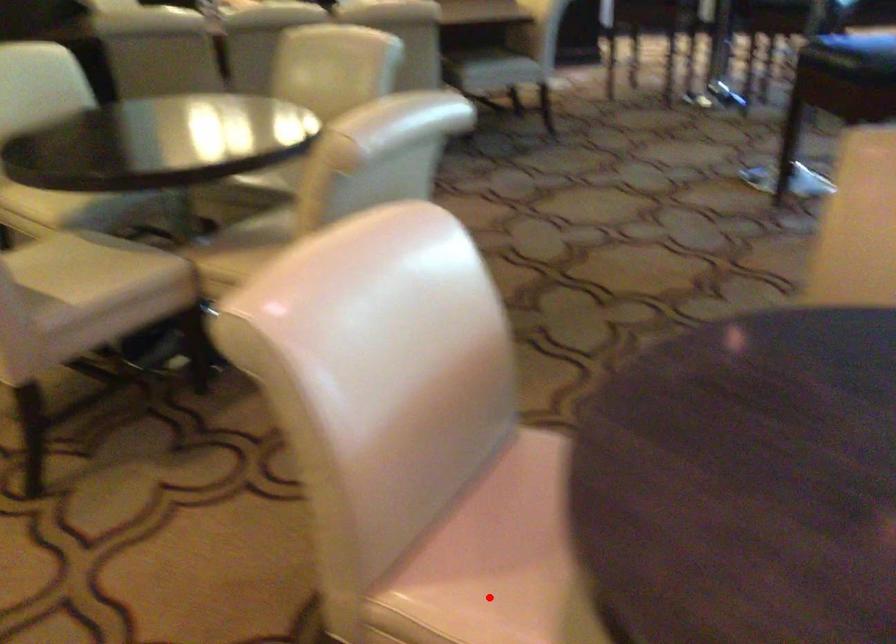
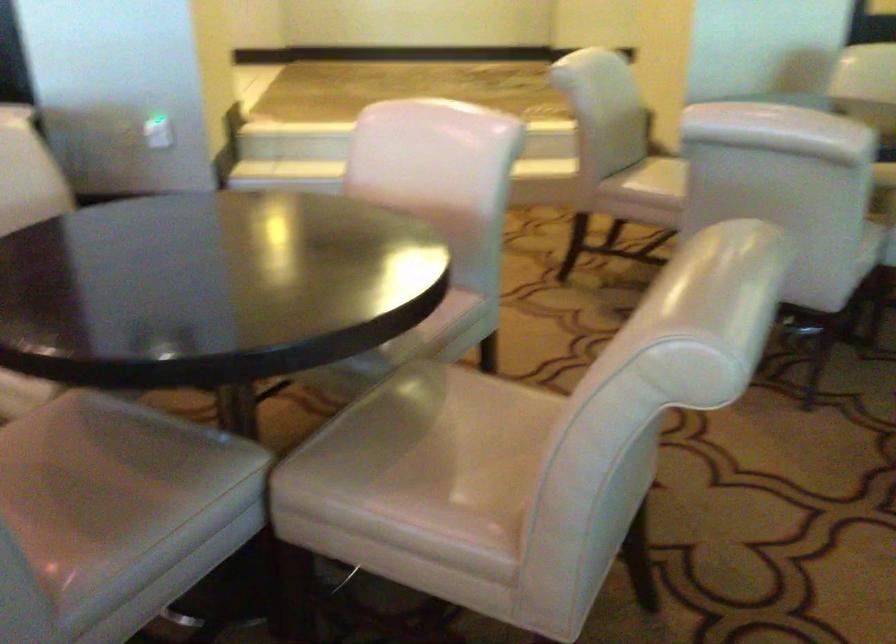
Question: I am providing you with two images of the same scene from different viewpoints. A red point is marked on the first image. At the location where the point appears in image 1, is it still visible in image 2?

Choices:
 (A) Yes
 (B) No

Answer: (B)